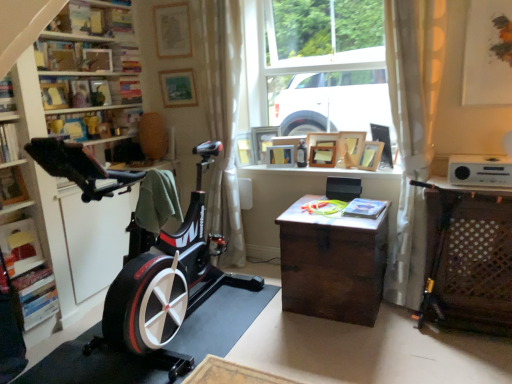
Identify the location of free point above wooden chest at center (from a real-world perspective). The image size is (512, 384). (332, 208).